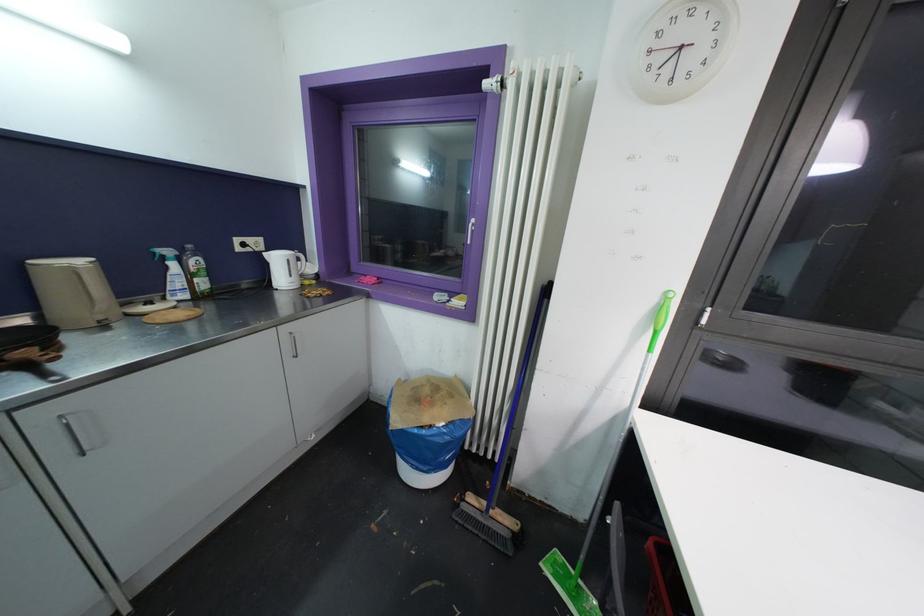
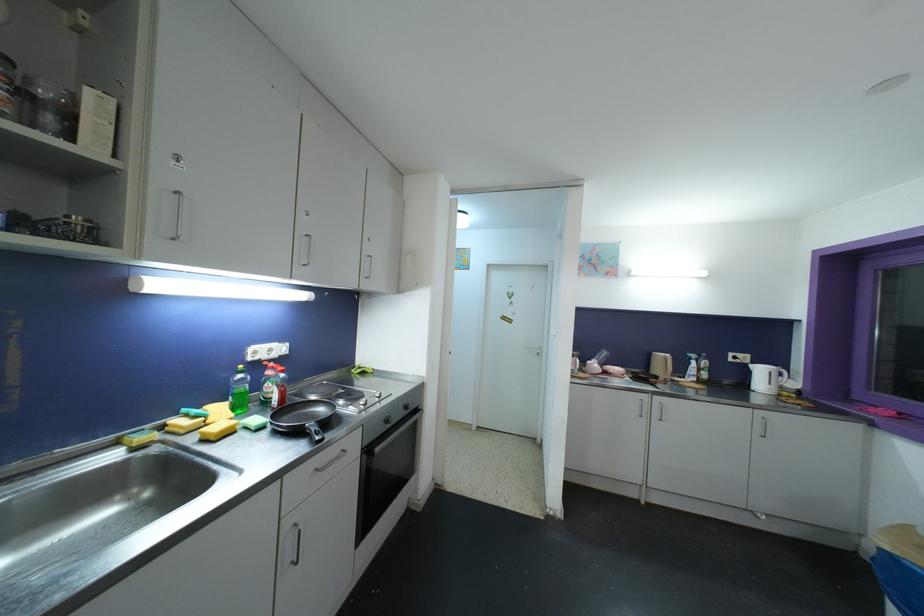
Find the pixel in the second image that matches point (281, 262) in the first image.

(763, 373)